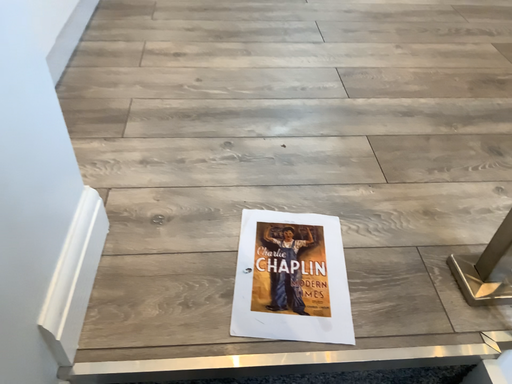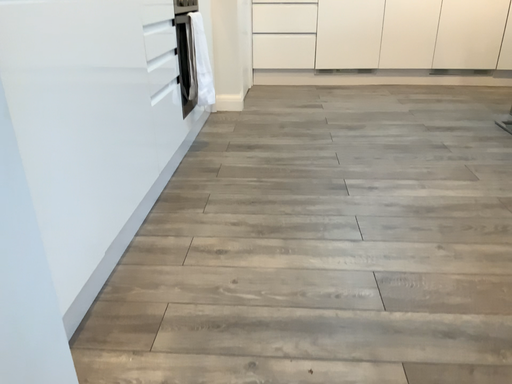
Question: Which way did the camera rotate in the video?

Choices:
 (A) rotated downward
 (B) rotated upward

Answer: (B)